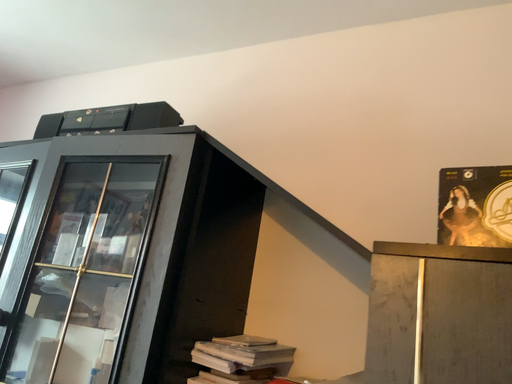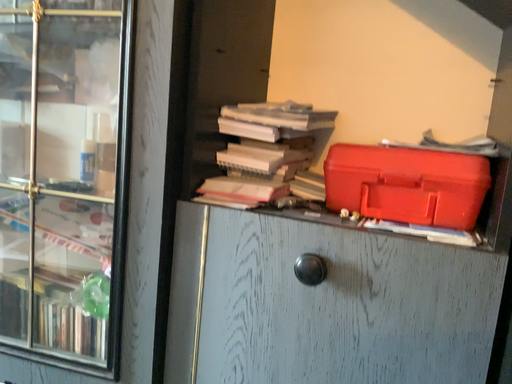
Question: Which way did the camera rotate in the video?

Choices:
 (A) rotated left
 (B) rotated right

Answer: (B)